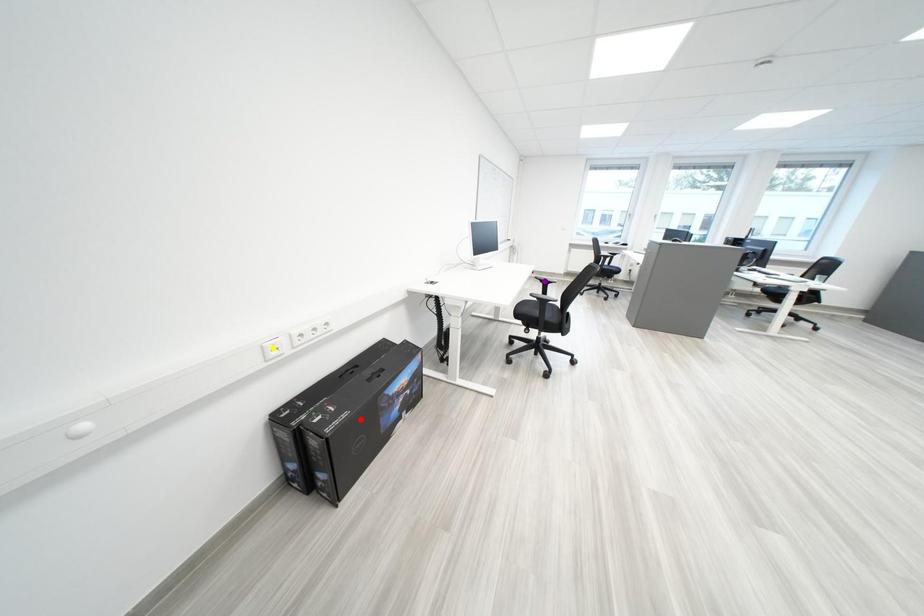
Order these from farthest to nearest:
purple point
red point
yellow point

purple point < red point < yellow point